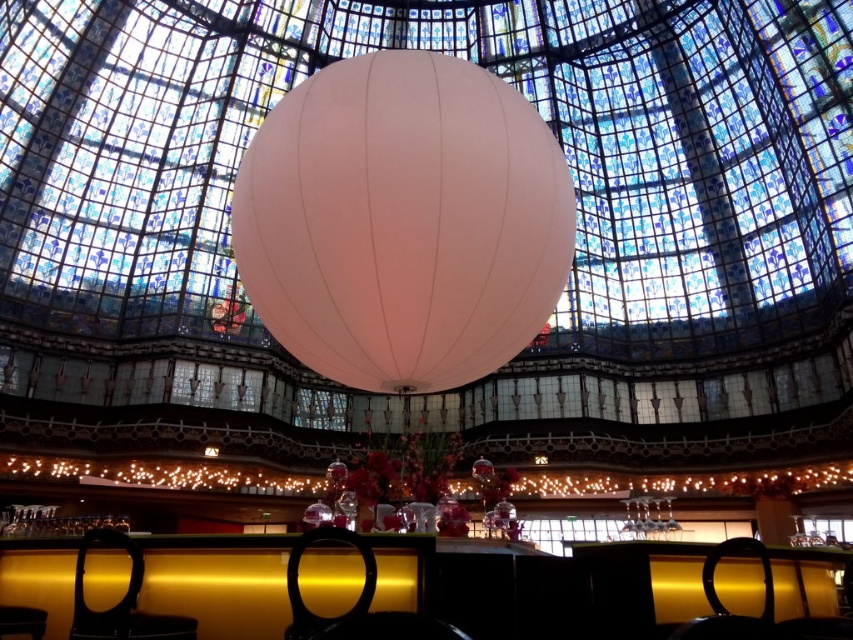
You are standing in the grand atrium and want to sit down. You see the gold metallic table at lower center and the black leather chair at lower center. Which object is closer to you so you can reach it first?

The gold metallic table at lower center is closer to you than the black leather chair at lower center, so you can reach it first.